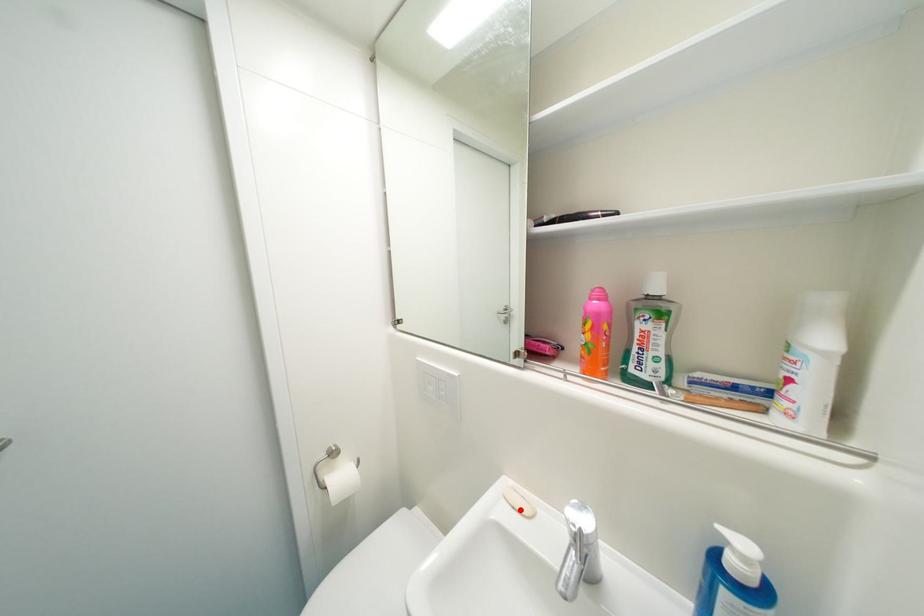
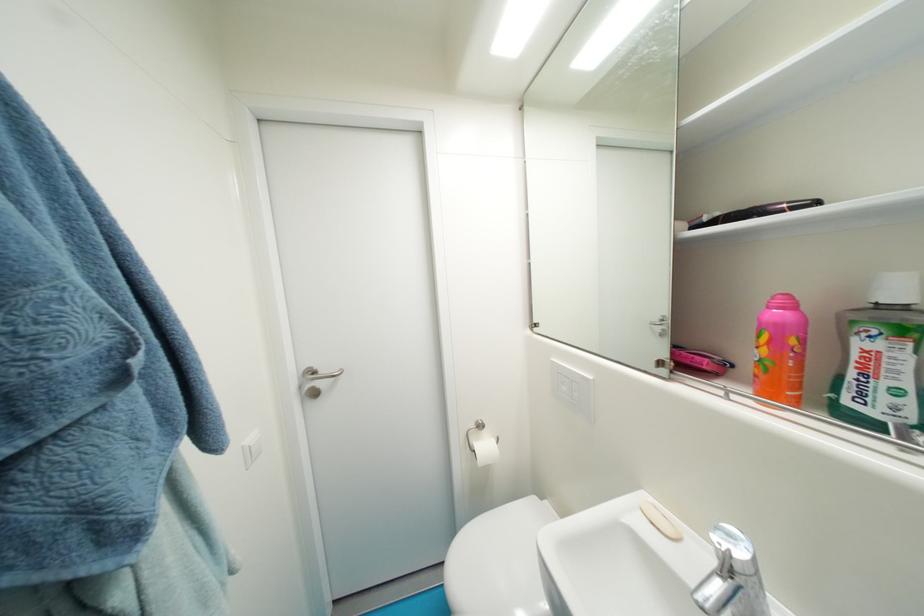
The point at the highlighted location is marked in the first image. Where is the corresponding point in the second image?

(659, 525)